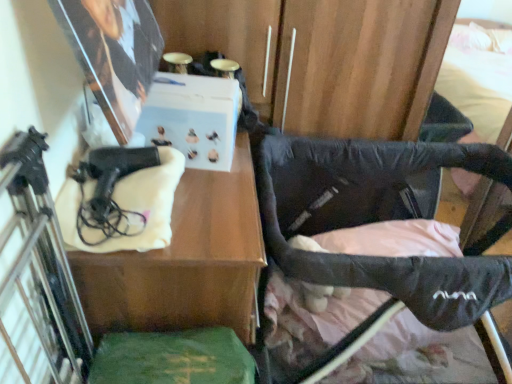
The image size is (512, 384). Describe the element at coordinates (185, 261) in the screenshot. I see `matte black hairdryer at left` at that location.

This screenshot has width=512, height=384. What do you see at coordinates (113, 172) in the screenshot?
I see `black matte gun at left` at bounding box center [113, 172].

In order to click on matte black hairdryer at left in this screenshot , I will do `click(185, 261)`.

Could you tell me if black fabric stroller at lower right is turned towards matte black hairdryer at left?

No, black fabric stroller at lower right is not aimed at matte black hairdryer at left.

What are the coordinates of `furniture below the matte black hairdryer at left (from the image's perspective)` in the screenshot? It's located at (379, 218).

How many degrees apart are the facing directions of black fabric stroller at lower right and matte black hairdryer at left?

The angle between the facing direction of black fabric stroller at lower right and the facing direction of matte black hairdryer at left is 90 degrees.

Between black fabric stroller at lower right and matte black hairdryer at left, which one has smaller width?

Thinner between the two is matte black hairdryer at left.

From the image's perspective, is black matte gun at left above or below black fabric stroller at lower right?

black matte gun at left is above black fabric stroller at lower right.

Which is more to the right, black matte gun at left or black fabric stroller at lower right?

From the viewer's perspective, black fabric stroller at lower right appears more on the right side.

This screenshot has width=512, height=384. Identify the location of furniture below the black matte gun at left (from the image's perspective). (379, 218).

Considering the points (239, 340) and (113, 169), which point is in front, point (239, 340) or point (113, 169)?

The point (113, 169) is closer.

From a real-world perspective, is green felt book at lower center physically located above or below black matte gun at left?

green felt book at lower center is below black matte gun at left.

Is black matte gun at left a part of green felt book at lower center?

That's incorrect, black matte gun at left is not inside green felt book at lower center.

How many degrees apart are the facing directions of green felt book at lower center and black matte gun at left?

4.11 degrees separate the facing orientations of green felt book at lower center and black matte gun at left.

Is green felt book at lower center facing away from matte black hairdryer at left?

green felt book at lower center is not turned away from matte black hairdryer at left.

Which object is positioned more to the right, green felt book at lower center or matte black hairdryer at left?

Positioned to the right is green felt book at lower center.

Is point (129, 338) positioned behind point (219, 311)?

No, it is not.

You are a GUI agent. You are given a task and a screenshot of the screen. Output one action in this format:
    pyautogui.click(x=<x>, y=<y>)
    Task: Click on the table on the left side of green felt book at lower center
    The width and height of the screenshot is (512, 384).
    Given the screenshot: What is the action you would take?
    pyautogui.click(x=185, y=261)

Looking at this image, which is more to the left, black matte gun at left or green felt book at lower center?

Positioned to the left is black matte gun at left.

In the image, is black matte gun at left positioned in front of or behind green felt book at lower center?

In the image, black matte gun at left appears behind green felt book at lower center.

Could you tell me if black matte gun at left is facing green felt book at lower center?

No, black matte gun at left is not facing towards green felt book at lower center.

Between black matte gun at left and green felt book at lower center, which one has larger size?

With larger size is green felt book at lower center.

Considering the relative sizes of matte black hairdryer at left and black fabric stroller at lower right in the image provided, is matte black hairdryer at left wider than black fabric stroller at lower right?

No.

Does matte black hairdryer at left lie in front of black fabric stroller at lower right?

Yes, it is in front of black fabric stroller at lower right.

Who is smaller, matte black hairdryer at left or black fabric stroller at lower right?

With smaller size is matte black hairdryer at left.

Does point (94, 255) lie behind point (448, 267)?

No, (94, 255) is closer to viewer.

Between black fabric stroller at lower right and black matte gun at left, which one has larger width?

black fabric stroller at lower right is wider.

From the picture: Is black fabric stroller at lower right shorter than black matte gun at left?

No.

Is point (318, 229) closer to viewer compared to point (101, 197)?

No, (318, 229) is behind (101, 197).

Is black fabric stroller at lower right closer to the viewer compared to black matte gun at left?

No, it is behind black matte gun at left.

In order to click on furniture on the right of matte black hairdryer at left in this screenshot , I will do `click(379, 218)`.

Where is `handgun above the black fabric stroller at lower right (from the image's perspective)`? This screenshot has width=512, height=384. handgun above the black fabric stroller at lower right (from the image's perspective) is located at coordinates (113, 172).

When comparing their distances from green felt book at lower center, does black matte gun at left or matte black hairdryer at left seem closer?

The object closer to green felt book at lower center is matte black hairdryer at left.

Looking at the image, which one is located further to black fabric stroller at lower right, green felt book at lower center or matte black hairdryer at left?

The object further to black fabric stroller at lower right is green felt book at lower center.

Considering their positions, is black matte gun at left positioned closer to matte black hairdryer at left than black fabric stroller at lower right?

black matte gun at left lies closer to matte black hairdryer at left than the other object.

When comparing their distances from green felt book at lower center, does matte black hairdryer at left or black fabric stroller at lower right seem further?

black fabric stroller at lower right lies further to green felt book at lower center than the other object.

From the image, which object appears to be farther from black matte gun at left, matte black hairdryer at left or black fabric stroller at lower right?

black fabric stroller at lower right is further to black matte gun at left.

From the image, which object appears to be farther from black fabric stroller at lower right, green felt book at lower center or black matte gun at left?

black matte gun at left is positioned further to the anchor black fabric stroller at lower right.

Which object lies nearer to the anchor point matte black hairdryer at left, black matte gun at left or green felt book at lower center?

green felt book at lower center.

Estimate the real-world distances between objects in this image. Which object is further from matte black hairdryer at left, green felt book at lower center or black matte gun at left?

black matte gun at left lies further to matte black hairdryer at left than the other object.

Image resolution: width=512 pixels, height=384 pixels. Find the location of `wide between matte black hairdryer at left and black fabric stroller at lower right from left to right`. wide between matte black hairdryer at left and black fabric stroller at lower right from left to right is located at coordinates (173, 358).

Identify the location of wide situated between black matte gun at left and black fabric stroller at lower right from left to right. [173, 358].

Locate an element on the screen. The width and height of the screenshot is (512, 384). table between black matte gun at left and green felt book at lower center in the up-down direction is located at coordinates (185, 261).

Where is `table between black matte gun at left and black fabric stroller at lower right in the horizontal direction`? The image size is (512, 384). table between black matte gun at left and black fabric stroller at lower right in the horizontal direction is located at coordinates coord(185,261).